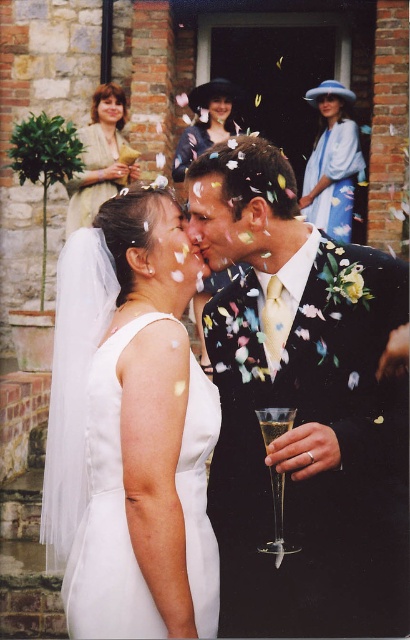
Is floral-patterned suit at center to the right of blue silk dress at upper center from the viewer's perspective?

No, floral-patterned suit at center is not to the right of blue silk dress at upper center.

Between point (198, 170) and point (343, 88), which one is positioned behind?

Point (343, 88)

Which is behind, point (314, 385) or point (343, 195)?

The point (343, 195) is more distant.

You are a GUI agent. You are given a task and a screenshot of the screen. Output one action in this format:
    pyautogui.click(x=<x>, y=<y>)
    Task: Click on the floral-patterned suit at center
    This screenshot has width=410, height=640.
    Given the screenshot: What is the action you would take?
    pyautogui.click(x=302, y=406)

Is white satin dress at center further to camera compared to clear glass wine glass at center?

A: No, white satin dress at center is closer to the viewer.

At what (x,y) coordinates should I click in order to perform the action: click on white satin dress at center. Please return your answer as a coordinate pair (x, y). Looking at the image, I should click on (131, 429).

Find the location of `white satin dress at center`. white satin dress at center is located at coordinates (131, 429).

Is floral-patterned suit at center shorter than clear glass wine glass at center?

In fact, floral-patterned suit at center may be taller than clear glass wine glass at center.

Does floral-patterned suit at center appear on the left side of clear glass wine glass at center?

No, floral-patterned suit at center is not to the left of clear glass wine glass at center.

Locate an element on the screen. The image size is (410, 640). floral-patterned suit at center is located at coordinates (302, 406).